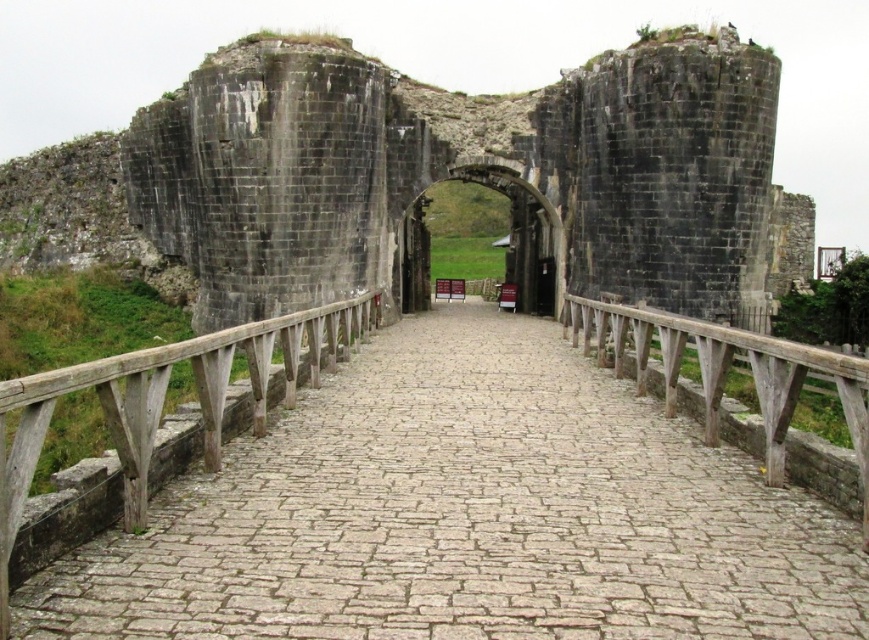
Can you confirm if smooth stone path at center is smaller than weathered wood rail at center?

Yes.

From the picture: Which is more to the left, smooth stone path at center or weathered wood rail at center?

From the viewer's perspective, smooth stone path at center appears more on the left side.

Does point (624, 384) come in front of point (673, 337)?

No.

Where is `smooth stone path at center`? The width and height of the screenshot is (869, 640). smooth stone path at center is located at coordinates (466, 516).

Who is more forward, (204, 211) or (244, 324)?

Point (244, 324) is more forward.

Based on the photo, between dark gray stone archway at center and wooden at left, which one is positioned lower?

Positioned lower is wooden at left.

Identify the location of dark gray stone archway at center. (461, 170).

Which is more to the right, dark gray stone archway at center or weathered wood rail at center?

weathered wood rail at center

Does dark gray stone archway at center appear under weathered wood rail at center?

Actually, dark gray stone archway at center is above weathered wood rail at center.

Image resolution: width=869 pixels, height=640 pixels. What do you see at coordinates (461, 170) in the screenshot? I see `dark gray stone archway at center` at bounding box center [461, 170].

This screenshot has width=869, height=640. I want to click on dark gray stone archway at center, so click(461, 170).